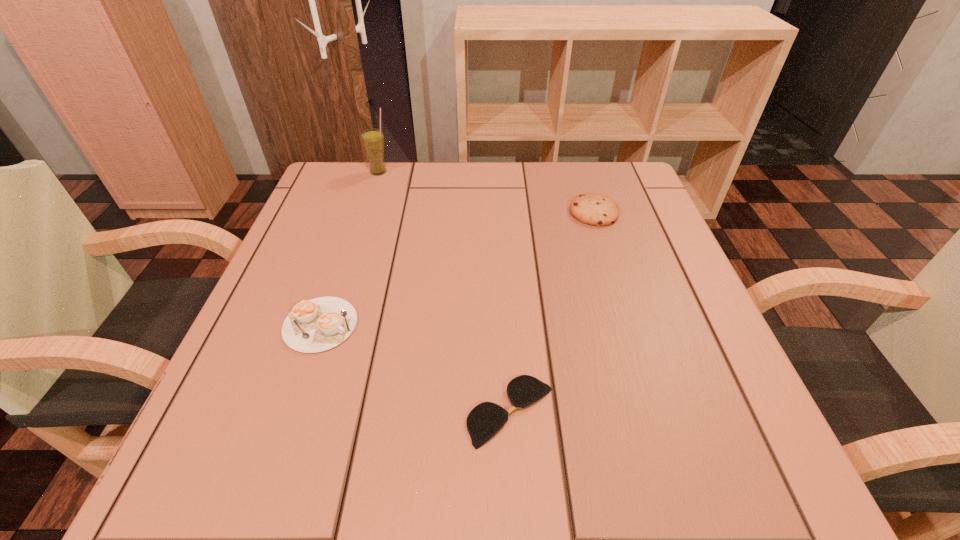
Where is `vacant position at the far edge of the desktop`? The image size is (960, 540). vacant position at the far edge of the desktop is located at coordinates (506, 187).

In the image, there is a desktop. What are the coordinates of `vacant region at the left edge` in the screenshot? It's located at (219, 420).

Where is `vacant region at the right edge of the desktop`? This screenshot has height=540, width=960. vacant region at the right edge of the desktop is located at coordinates (660, 281).

Where is `vacant space at the far left corner of the desktop`? The image size is (960, 540). vacant space at the far left corner of the desktop is located at coordinates (331, 167).

You are a GUI agent. You are given a task and a screenshot of the screen. Output one action in this format:
    pyautogui.click(x=<x>, y=<y>)
    Task: Click on the free spot at the far right corner of the desktop
    
    Given the screenshot: What is the action you would take?
    pyautogui.click(x=624, y=168)

Image resolution: width=960 pixels, height=540 pixels. I want to click on free space at the near right corner of the desktop, so 780,491.

Locate an element on the screen. Image resolution: width=960 pixels, height=540 pixels. vacant space in between the third tallest object and the second object from right to left is located at coordinates (416, 368).

Where is `free spot between the cookie and the tallest object`? The width and height of the screenshot is (960, 540). free spot between the cookie and the tallest object is located at coordinates (487, 192).

You are a GUI agent. You are given a task and a screenshot of the screen. Output one action in this format:
    pyautogui.click(x=<x>, y=<y>)
    Task: Click on the free spot between the farthest object and the second farthest object
    This screenshot has height=540, width=960.
    Given the screenshot: What is the action you would take?
    pyautogui.click(x=487, y=192)

The width and height of the screenshot is (960, 540). In order to click on free space between the rightmost object and the third tallest object in this screenshot , I will do `click(457, 268)`.